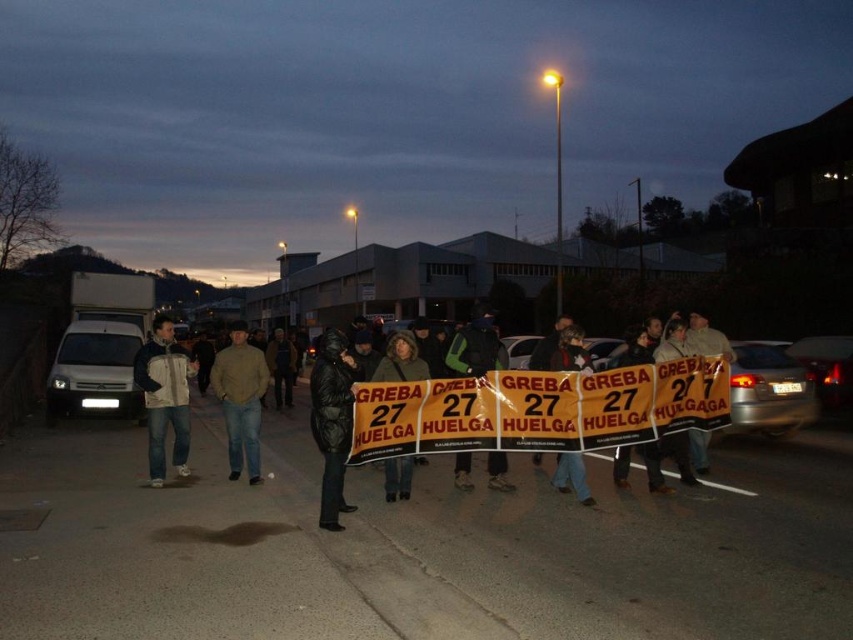
You are a photographer trying to capture a photo of the protest scene. You want to ensure both the black jacket at center and the white fleece jacket at left are clearly visible in the frame. Given their sizes, which jacket should you focus on to ensure both are in focus?

The black jacket at center is much taller than the white fleece jacket at left. To ensure both are in focus, you should focus on the black jacket at center since it is larger and will require more precise focus to capture details, while the smaller white fleece jacket at left will naturally fall within the depth of field.

You are standing at the point where the streetlight is located. Looking towards the group of people holding signs, which of the two points, point (x=161, y=348) or point (x=398, y=481), is closer to you?

Point (x=398, y=481) is closer to you because it is in front of point (x=161, y=348).